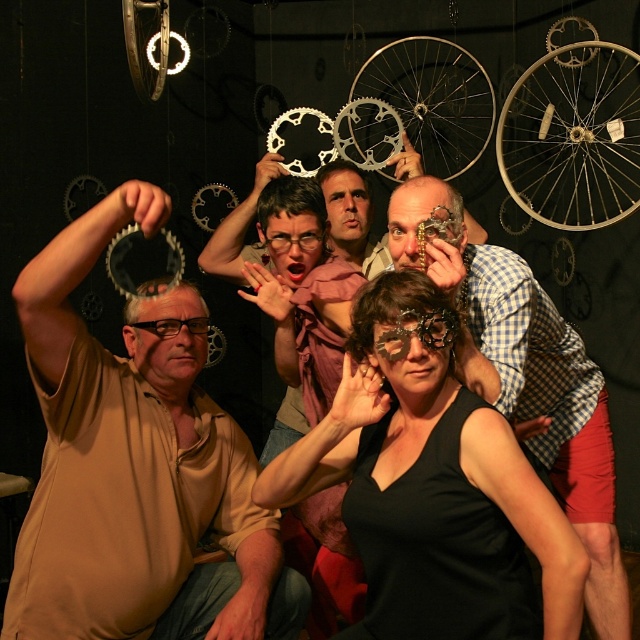
Can you confirm if black matte tank top at center is positioned above matte plastic face at center?

No.

Is point (413, 460) less distant than point (426, 198)?

Yes, point (413, 460) is closer to viewer.

Measure the distance between point (486, 531) and camera.

Point (486, 531) is 5.02 feet from camera.

Where is `black matte tank top at center`? The height and width of the screenshot is (640, 640). black matte tank top at center is located at coordinates (429, 467).

Based on the photo, does matte gold shirt at center come in front of black matte tank top at center?

No, matte gold shirt at center is further to the viewer.

Who is more forward, (93,508) or (490,536)?

Point (490,536)

Find the location of a particular element. Image resolution: width=640 pixels, height=640 pixels. matte gold shirt at center is located at coordinates (136, 467).

Does matte plastic face at center come behind black matte mask at center?

Yes, matte plastic face at center is behind black matte mask at center.

Who is shorter, matte plastic face at center or black matte mask at center?

With less height is black matte mask at center.

Between point (442, 184) and point (444, 308), which one is positioned behind?

The point (442, 184) is behind.

What are the coordinates of `matte plastic face at center` in the screenshot? It's located at (x=422, y=221).